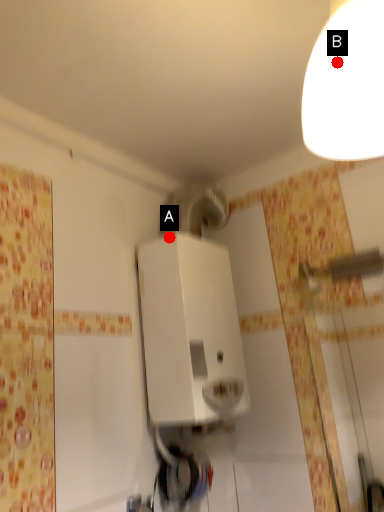
Question: Two points are circled on the image, labeled by A and B beside each circle. Which of the following is the closest to the observer?

Choices:
 (A) A is closer
 (B) B is closer

Answer: (B)